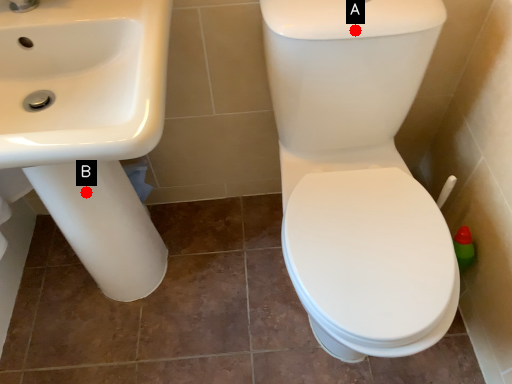
Question: Two points are circled on the image, labeled by A and B beside each circle. Among these points, which one is farthest from the camera?

Choices:
 (A) A is further
 (B) B is further

Answer: (B)